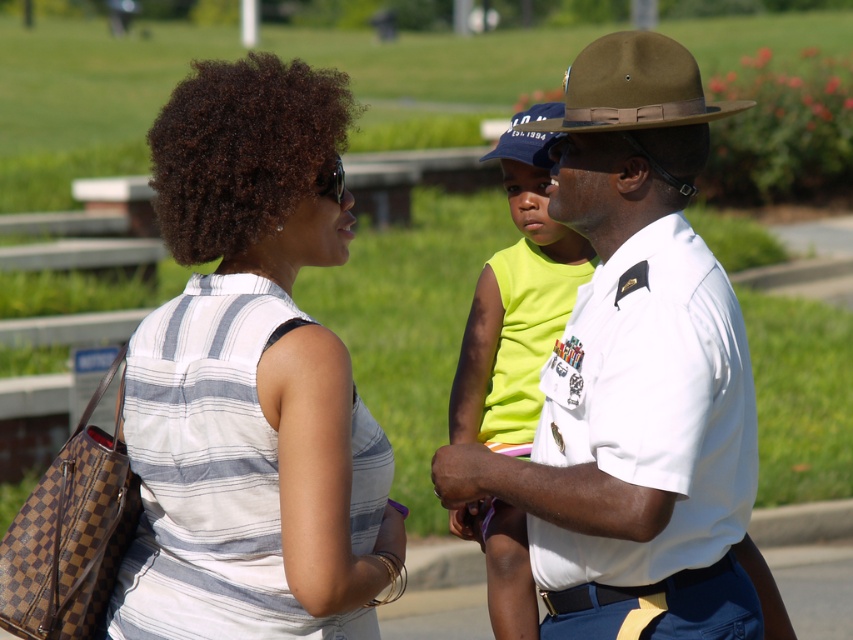
Who is taller, white uniform at center or brown leather cowboy hat at upper center?

brown leather cowboy hat at upper center

Is point (682, 435) more distant than point (675, 45)?

No, (682, 435) is in front of (675, 45).

You are a GUI agent. You are given a task and a screenshot of the screen. Output one action in this format:
    pyautogui.click(x=<x>, y=<y>)
    Task: Click on the white uniform at center
    
    Given the screenshot: What is the action you would take?
    pyautogui.click(x=636, y=378)

Looking at this image, is white striped shirt at center wider than blue fabric baseball cap at center?

No, white striped shirt at center is not wider than blue fabric baseball cap at center.

Between white striped shirt at center and blue fabric baseball cap at center, which one has less height?

white striped shirt at center

Where is `white striped shirt at center`? white striped shirt at center is located at coordinates (251, 378).

Is point (300, 352) more distant than point (630, 108)?

No.

Locate an element on the screen. white striped shirt at center is located at coordinates [x=251, y=378].